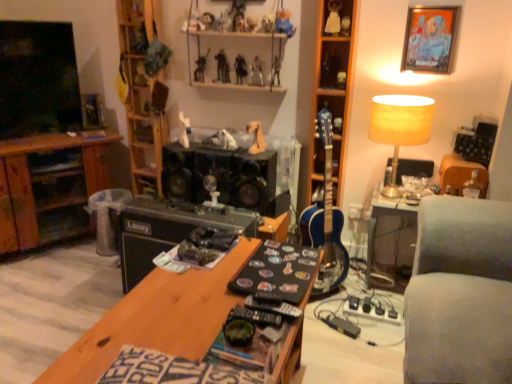
This screenshot has width=512, height=384. What do you see at coordinates (141, 92) in the screenshot? I see `wooden at left, which ranks as the 1th shelf in left-to-right order` at bounding box center [141, 92].

I want to click on white plush dog at center, marked as the 12th toy in a right-to-left arrangement, so click(223, 139).

What are the coordinates of `orange matte horse at center, arranged as the 9th toy when viewed from the left` in the screenshot? It's located at (256, 137).

The width and height of the screenshot is (512, 384). What are the coordinates of `wooden at left, the third shelf viewed from the right` in the screenshot? It's located at (141, 92).

Which of these two, metallic silver action figure at upper center, which is counted as the ninth toy, starting from the right, or gray fabric couch at right, stands shorter?

metallic silver action figure at upper center, which is counted as the ninth toy, starting from the right.

Can you confirm if metallic silver action figure at upper center, which is counted as the ninth toy, starting from the right, is thinner than gray fabric couch at right?

Indeed, metallic silver action figure at upper center, which is counted as the ninth toy, starting from the right, has a lesser width compared to gray fabric couch at right.

The width and height of the screenshot is (512, 384). I want to click on the 9th toy counting from the left side of the gray fabric couch at right, so coord(239,22).

From the image's perspective, which is above, matte plastic action figure at upper center, the 4th toy from the left, or yellow fabric lampshade at upper right?

matte plastic action figure at upper center, the 4th toy from the left.

Considering the positions of objects matte plastic action figure at upper center, the 4th toy from the left, and yellow fabric lampshade at upper right in the image provided, who is more to the right, matte plastic action figure at upper center, the 4th toy from the left, or yellow fabric lampshade at upper right?

yellow fabric lampshade at upper right is more to the right.

Is the position of matte plastic action figure at upper center, placed as the thirteenth toy when sorted from right to left, more distant than that of yellow fabric lampshade at upper right?

Yes, matte plastic action figure at upper center, placed as the thirteenth toy when sorted from right to left, is further from the viewer.

Is metallic figure at upper center, the fifteenth toy from the right, wider or thinner than blue wood guitar at center-right?

Clearly, metallic figure at upper center, the fifteenth toy from the right, has less width compared to blue wood guitar at center-right.

Between metallic figure at upper center, the fifteenth toy from the right, and blue wood guitar at center-right, which one has more height?

blue wood guitar at center-right.

Does point (201, 79) come farther from viewer compared to point (340, 250)?

Yes, point (201, 79) is farther from viewer.

Is metallic figure at upper center, the fifteenth toy from the right, not inside blue wood guitar at center-right?

metallic figure at upper center, the fifteenth toy from the right, is positioned outside blue wood guitar at center-right.

Considering the sizes of metallic figure at upper center, acting as the second toy starting from the left, and wooden shelf at upper center, the 2th shelf from the left, in the image, is metallic figure at upper center, acting as the second toy starting from the left, bigger or smaller than wooden shelf at upper center, the 2th shelf from the left,?

metallic figure at upper center, acting as the second toy starting from the left, is smaller than wooden shelf at upper center, the 2th shelf from the left.

Does metallic figure at upper center, acting as the second toy starting from the left, come behind wooden shelf at upper center, the 2th shelf from the left?

Yes.

From the picture: Which object is wider, metallic figure at upper center, the fifteenth toy from the right, or wooden shelf at upper center, the 2th shelf from the left?

wooden shelf at upper center, the 2th shelf from the left, is wider.

The width and height of the screenshot is (512, 384). Find the location of `the 5th toy directly beneath the wooden shelf at upper center, the 2th shelf from the left (from a real-world perspective)`. the 5th toy directly beneath the wooden shelf at upper center, the 2th shelf from the left (from a real-world perspective) is located at coordinates (201, 67).

Identify the location of studio couch on the right of clear plastic trash bin at center. (460, 293).

Based on the photo, between gray fabric couch at right and clear plastic trash bin at center, which one has larger width?

gray fabric couch at right.

Considering the sizes of objects gray fabric couch at right and clear plastic trash bin at center in the image provided, who is smaller, gray fabric couch at right or clear plastic trash bin at center?

clear plastic trash bin at center.

Is gray fabric couch at right taller than clear plastic trash bin at center?

Correct, gray fabric couch at right is much taller as clear plastic trash bin at center.

From the image's perspective, is orange matte horse at center, placed as the 8th toy when sorted from right to left, under metallic silver figure at upper center, the sixth toy positioned from the right?

Yes.

Between orange matte horse at center, placed as the 8th toy when sorted from right to left, and metallic silver figure at upper center, the sixth toy positioned from the right, which one has larger size?

orange matte horse at center, placed as the 8th toy when sorted from right to left, is bigger.

Who is taller, orange matte horse at center, arranged as the 9th toy when viewed from the left, or metallic silver figure at upper center, positioned as the eleventh toy in left-to-right order?

With more height is orange matte horse at center, arranged as the 9th toy when viewed from the left.

In the scene shown: Which is more to the right, orange matte horse at center, arranged as the 9th toy when viewed from the left, or metallic silver figure at upper center, the sixth toy positioned from the right?

Positioned to the right is metallic silver figure at upper center, the sixth toy positioned from the right.

How far apart are metallic silver figure at upper center, the sixth toy positioned from the right, and wooden shelf at upper center, placed as the 2th shelf when sorted from right to left?

metallic silver figure at upper center, the sixth toy positioned from the right, and wooden shelf at upper center, placed as the 2th shelf when sorted from right to left, are 8.80 inches apart.

Is metallic silver figure at upper center, positioned as the eleventh toy in left-to-right order, facing away from wooden shelf at upper center, the 2th shelf from the left?

Correct, metallic silver figure at upper center, positioned as the eleventh toy in left-to-right order, is looking away from wooden shelf at upper center, the 2th shelf from the left.

Which object is wider, metallic silver figure at upper center, the sixth toy positioned from the right, or wooden shelf at upper center, placed as the 2th shelf when sorted from right to left?

With larger width is wooden shelf at upper center, placed as the 2th shelf when sorted from right to left.

Are metallic silver figure at upper center, positioned as the eleventh toy in left-to-right order, and wooden shelf at upper center, placed as the 2th shelf when sorted from right to left, beside each other?

No, metallic silver figure at upper center, positioned as the eleventh toy in left-to-right order, is not touching wooden shelf at upper center, placed as the 2th shelf when sorted from right to left.

The height and width of the screenshot is (384, 512). What are the coordinates of `table to the right of metallic silver action figure at upper center, which is counted as the ninth toy, starting from the right` in the screenshot? It's located at (391, 243).

Find the location of a particular element. lamp located in front of the matte plastic action figure at upper center, the 4th toy from the left is located at coordinates (400, 127).

Consider the image. When comparing their distances from orange matte horse at center, arranged as the 9th toy when viewed from the left, does gray fabric couch at right or metallic silver action figure at upper center, the twelfth toy viewed from the left, seem closer?

metallic silver action figure at upper center, the twelfth toy viewed from the left.

Looking at the image, which one is located further to matte plastic action figure at upper center, the 4th toy from the left, shiny plastic action figure at upper center, placed as the tenth toy when sorted from right to left, or wooden at left, the third shelf viewed from the right?

wooden at left, the third shelf viewed from the right.

Looking at the image, which one is located further to metallic silver action figure at upper center, which is counted as the 7th toy, starting from the right, gray fabric couch at right or metallic silver picture frame at upper right?

The object further to metallic silver action figure at upper center, which is counted as the 7th toy, starting from the right, is gray fabric couch at right.

Looking at the image, which one is located closer to clear plastic trash bin at center, metallic silver action figure at upper center, the tenth toy when ordered from left to right, or white plush bear at upper center, the 2th toy positioned from the right?

Based on the image, metallic silver action figure at upper center, the tenth toy when ordered from left to right, appears to be nearer to clear plastic trash bin at center.

Considering their positions, is plastic toy at upper center, arranged as the sixteenth toy when viewed from the left, positioned further to metallic figure at upper center, the fifteenth toy from the right, than wooden shelf at upper center, placed as the 2th shelf when sorted from right to left?

The object further to metallic figure at upper center, the fifteenth toy from the right, is plastic toy at upper center, arranged as the sixteenth toy when viewed from the left.

When comparing their distances from blue wood guitar at center-right, does metallic silver action figure at upper center, which ranks as the 8th toy in left-to-right order, or clear plastic trash bin at center seem closer?

clear plastic trash bin at center.

When comparing their distances from gray fabric couch at right, does plastic toy at upper center, the first toy viewed from the right, or gray fabric couch at right seem closer?

gray fabric couch at right.

Estimate the real-world distances between objects in this image. Which object is further from white plastic toy at center, marked as the first toy in a left-to-right arrangement, shiny plastic action figure at upper center, positioned as the 7th toy in left-to-right order, or metallic silver action figure at upper center, placed as the 3th toy when sorted from left to right?

The object further to white plastic toy at center, marked as the first toy in a left-to-right arrangement, is metallic silver action figure at upper center, placed as the 3th toy when sorted from left to right.

Identify the location of lamp positioned between gray fabric couch at right and white plush bear at upper center, which is the fifteenth toy in left-to-right order, from near to far. (400, 127).

At what (x,y) coordinates should I click in order to perform the action: click on speaker located between wooden at left, which ranks as the 1th shelf in left-to-right order, and wooden shelf at upper right, which is the third shelf in left-to-right order, in the left-right direction. Please return your answer as a coordinate pair (x, y). Looking at the image, I should click on (220, 175).

Image resolution: width=512 pixels, height=384 pixels. In order to click on speaker between matte plastic action figure at upper center, the 4th toy from the left, and clear plastic trash bin at center in the up-down direction in this screenshot , I will do `click(220, 175)`.

In order to click on table located between gray fabric couch at right and black matte speaker at center in the depth direction in this screenshot , I will do `click(391, 243)`.